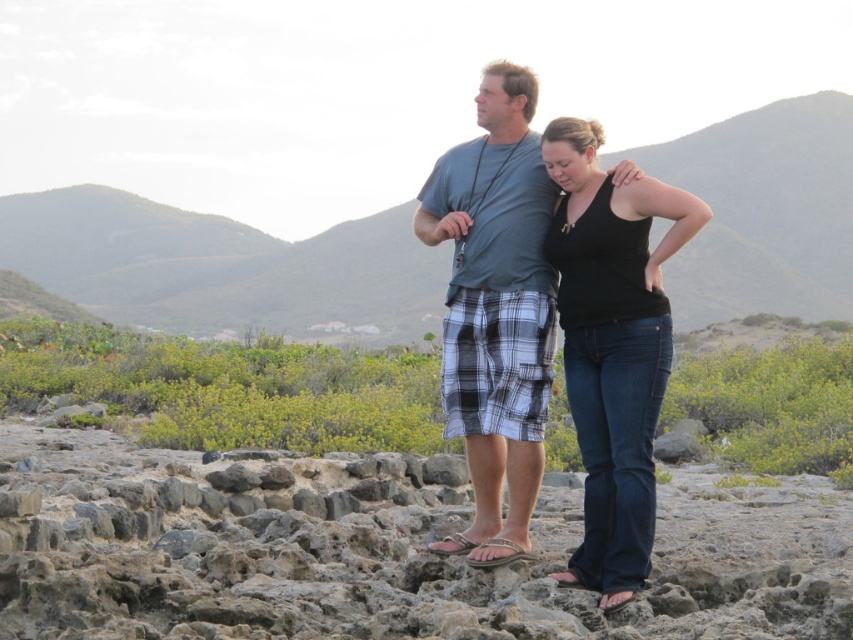
Question: Can you confirm if rusty stone at center is bigger than green grassy hill at upper center?

Choices:
 (A) yes
 (B) no

Answer: (B)

Question: Which object is the closest to the gray plaid shorts at center?

Choices:
 (A) black denim jeans at center
 (B) green grassy hill at upper center
 (C) rusty stone at center

Answer: (A)

Question: Can you confirm if green grassy hill at upper center is positioned to the right of black denim jeans at center?

Choices:
 (A) no
 (B) yes

Answer: (A)

Question: Is green grassy hill at upper center above gray plaid shorts at center?

Choices:
 (A) yes
 (B) no

Answer: (A)

Question: Which is nearer to the green grassy hill at upper center?

Choices:
 (A) rusty stone at center
 (B) black denim jeans at center

Answer: (B)

Question: Which point is farther to the camera?

Choices:
 (A) rusty stone at center
 (B) gray plaid shorts at center
 (C) green grassy hill at upper center
 (D) black denim jeans at center

Answer: (C)